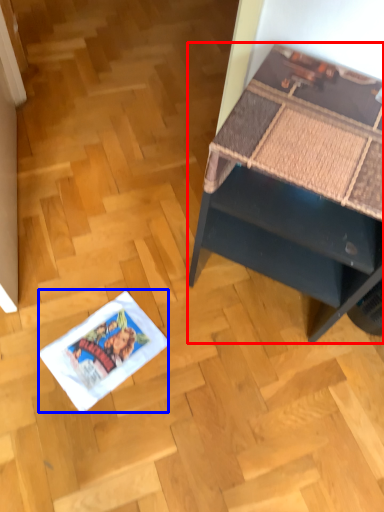
Question: Which point is further to the camera, desk (highlighted by a red box) or comic book (highlighted by a blue box)?

Choices:
 (A) desk
 (B) comic book

Answer: (B)